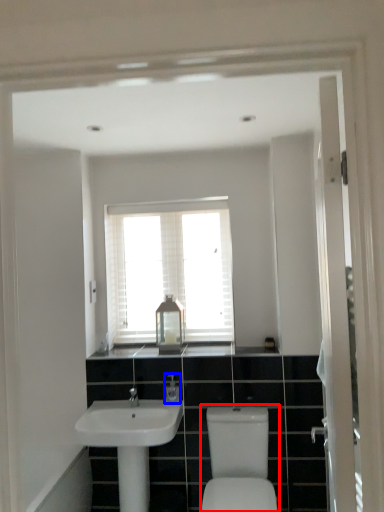
Question: Which of the following is the farthest to the observer, sink (highlighted by a red box) or toiletry (highlighted by a blue box)?

Choices:
 (A) sink
 (B) toiletry

Answer: (B)